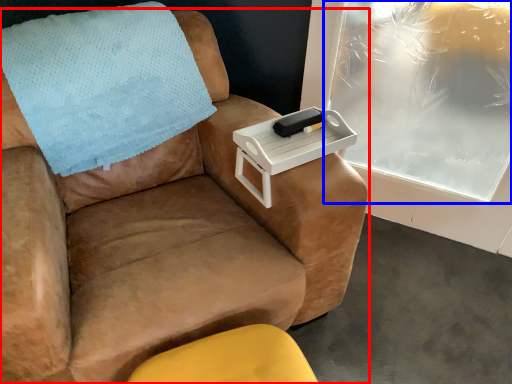
Question: Among these objects, which one is farthest to the camera, chair (highlighted by a red box) or window screen (highlighted by a blue box)?

Choices:
 (A) chair
 (B) window screen

Answer: (B)